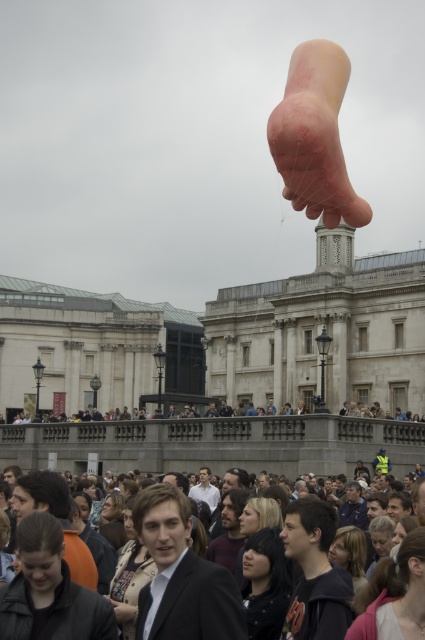
You are standing at the point with coordinates point (314,136). What object are you standing on?

You are standing on the pink rubber foot at upper center.